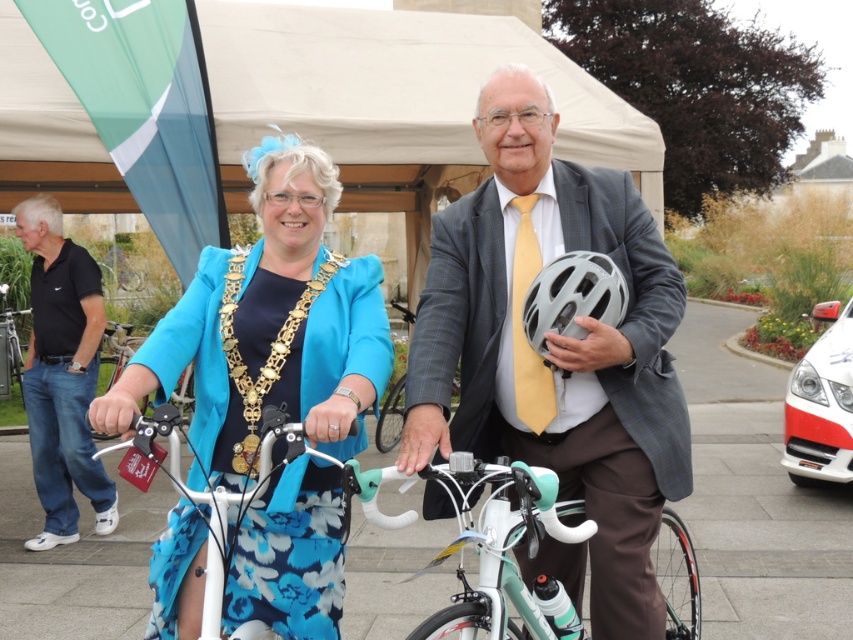
Between matte gray helmet at center and matte blue jacket at center, which one is positioned lower?

Positioned lower is matte blue jacket at center.

At what (x,y) coordinates should I click in order to perform the action: click on matte gray helmet at center. Please return your answer as a coordinate pair (x, y). Looking at the image, I should click on (555, 348).

Between teal fabric jacket at center and silver metallic bicycle at left, which one has more height?

teal fabric jacket at center is taller.

Locate an element on the screen. teal fabric jacket at center is located at coordinates (555, 353).

At what (x,y) coordinates should I click in order to perform the action: click on teal fabric jacket at center. Please return your answer as a coordinate pair (x, y). Looking at the image, I should click on (555, 353).

The image size is (853, 640). In order to click on teal fabric jacket at center in this screenshot , I will do `click(555, 353)`.

Can you confirm if matte blue jacket at center is positioned to the left of black cotton polo shirt at left?

Incorrect, matte blue jacket at center is not on the left side of black cotton polo shirt at left.

Does point (297, 298) come in front of point (68, 476)?

That is True.

Which is behind, point (268, 241) or point (36, 456)?

Point (36, 456)

Find the location of a particular element. matte blue jacket at center is located at coordinates (270, 326).